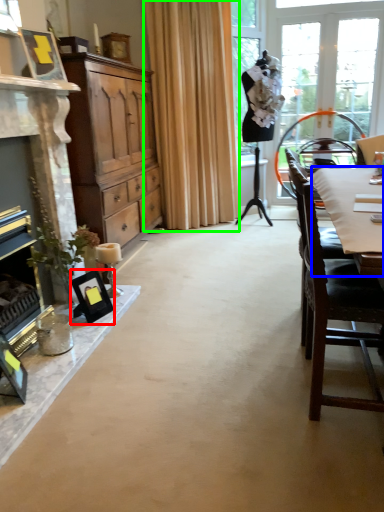
Question: Which object is positioned closest to picture frame (highlighted by a red box)? Select from desk (highlighted by a blue box) and curtain (highlighted by a green box).

Choices:
 (A) desk
 (B) curtain

Answer: (A)